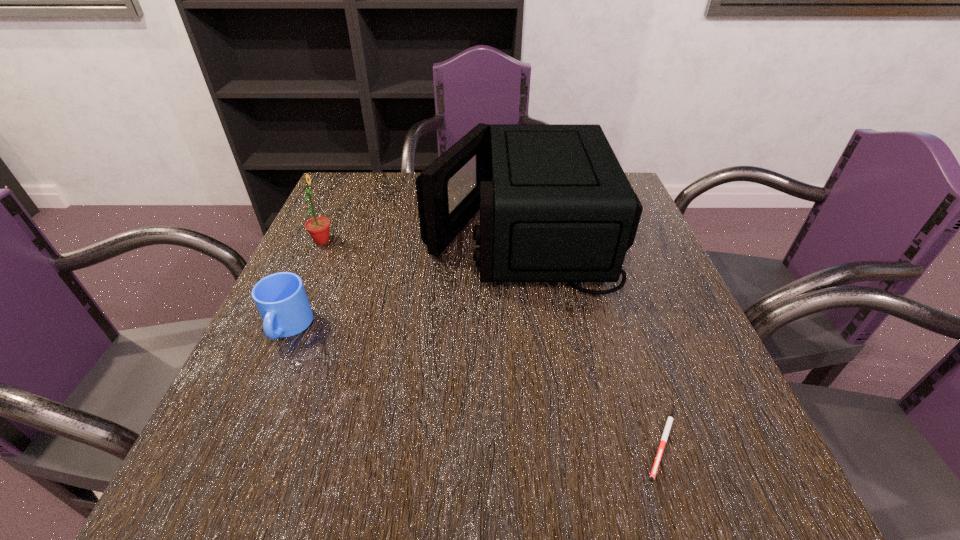
This screenshot has height=540, width=960. I want to click on microwave oven, so click(555, 205).

I want to click on sunflower, so click(x=318, y=227).

This screenshot has width=960, height=540. Find the location of `the third tallest object`. the third tallest object is located at coordinates (281, 299).

You are a GUI agent. You are given a task and a screenshot of the screen. Output one action in this format:
    pyautogui.click(x=<x>, y=<y>)
    Task: Click on the third farthest object
    
    Given the screenshot: What is the action you would take?
    pyautogui.click(x=281, y=299)

Identify the location of the shortest object. This screenshot has height=540, width=960. (670, 419).

At what (x,y) coordinates should I click in order to perform the action: click on pen. Please return your answer as a coordinate pair (x, y). Looking at the image, I should click on 670,419.

Locate an element on the screen. blank space located with the door open on the tallest object is located at coordinates (325, 233).

At what (x,y) coordinates should I click in order to perform the action: click on vacant space located 0.110m with the door open on the tallest object. Please return your answer as a coordinate pair (x, y). This screenshot has height=540, width=960. Looking at the image, I should click on (382, 233).

Identify the location of vacant space situated with the door open on the tallest object. (362, 233).

At what (x,y) coordinates should I click in order to perform the action: click on vacant position located 0.170m on the face of the third shortest object. Please return your answer as a coordinate pair (x, y). This screenshot has width=960, height=540. Looking at the image, I should click on (404, 240).